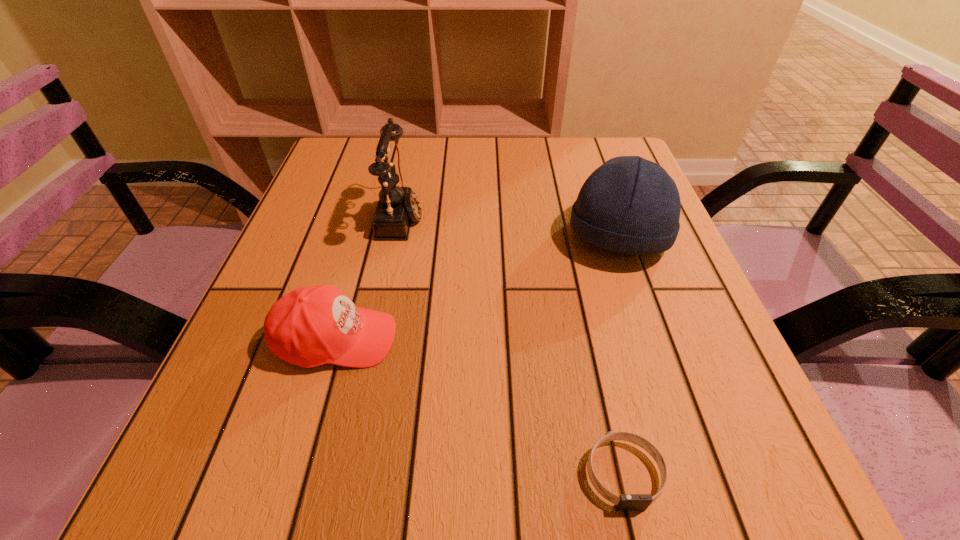
In order to click on object that is at the left edge in this screenshot , I will do [x=310, y=326].

In order to click on object positioned at the right edge in this screenshot , I will do `click(631, 205)`.

This screenshot has width=960, height=540. In the image, there is a desktop. What are the coordinates of `vacant space at the far edge` in the screenshot? It's located at (523, 184).

Image resolution: width=960 pixels, height=540 pixels. In order to click on vacant area at the near edge in this screenshot , I will do `click(640, 473)`.

This screenshot has width=960, height=540. I want to click on vacant space at the left edge of the desktop, so click(x=279, y=422).

Locate an element on the screen. The image size is (960, 540). vacant space at the right edge is located at coordinates (674, 348).

Locate an element on the screen. This screenshot has height=540, width=960. free location at the far left corner of the desktop is located at coordinates (320, 176).

Identify the location of vacant point at the near left corner. (239, 446).

Identify the location of free space at the far right corner. The width and height of the screenshot is (960, 540). (577, 159).

The image size is (960, 540). Identify the location of vacant area that lies between the skullcap and the second nearest object. (477, 288).